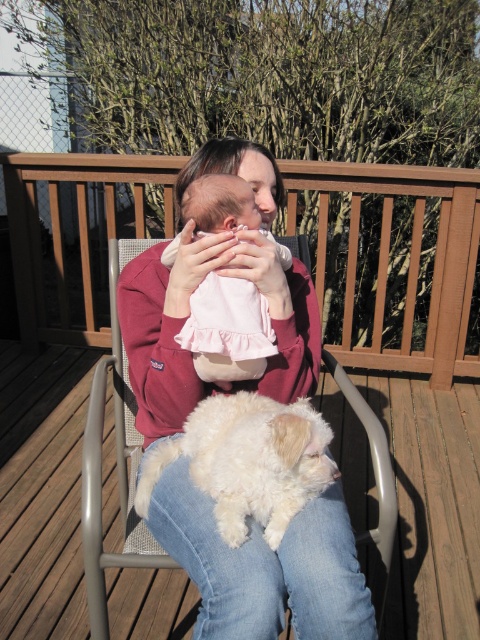
You are a photographer setting up a shot of the metallic gray chair at center and the pink satin baby at center. To ensure both subjects are in frame, should you adjust your camera to the left or right of the current position?

The metallic gray chair at center is positioned on the left side of the pink satin baby at center, so you should adjust your camera to the right to include both subjects in the frame.

From the picture: Based on the provided scene description, where exactly is the white fluffy dog at center located in terms of coordinates?

The white fluffy dog at center is located at point coordinates of (248, 461).